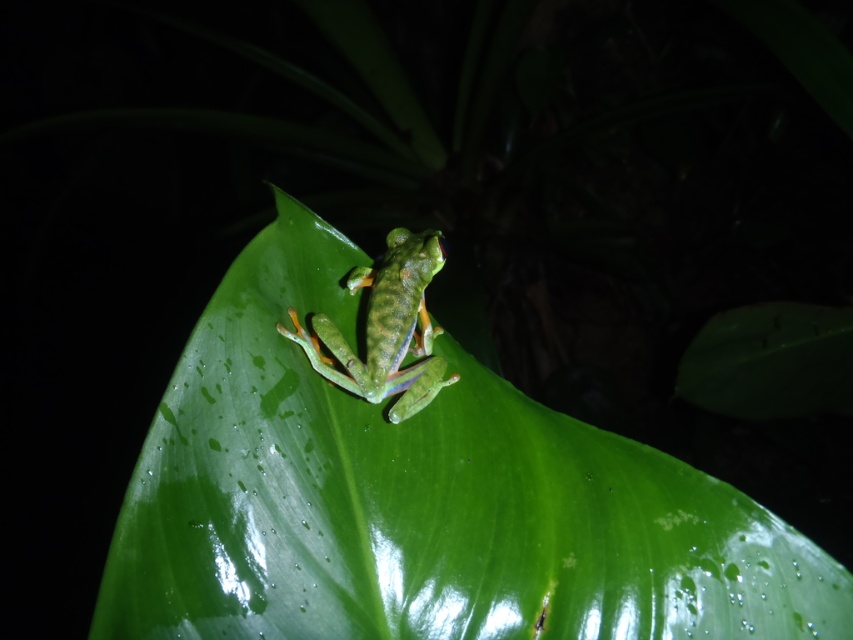
Is glossy green leaf at center taller than green matte/frosted frog at center?

Correct, glossy green leaf at center is much taller as green matte/frosted frog at center.

Is point (461, 566) closer to viewer compared to point (418, 298)?

That is True.

Who is more distant from viewer, (200, 396) or (354, 275)?

The point (354, 275) is behind.

Where is `glossy green leaf at center`? Image resolution: width=853 pixels, height=640 pixels. glossy green leaf at center is located at coordinates (421, 499).